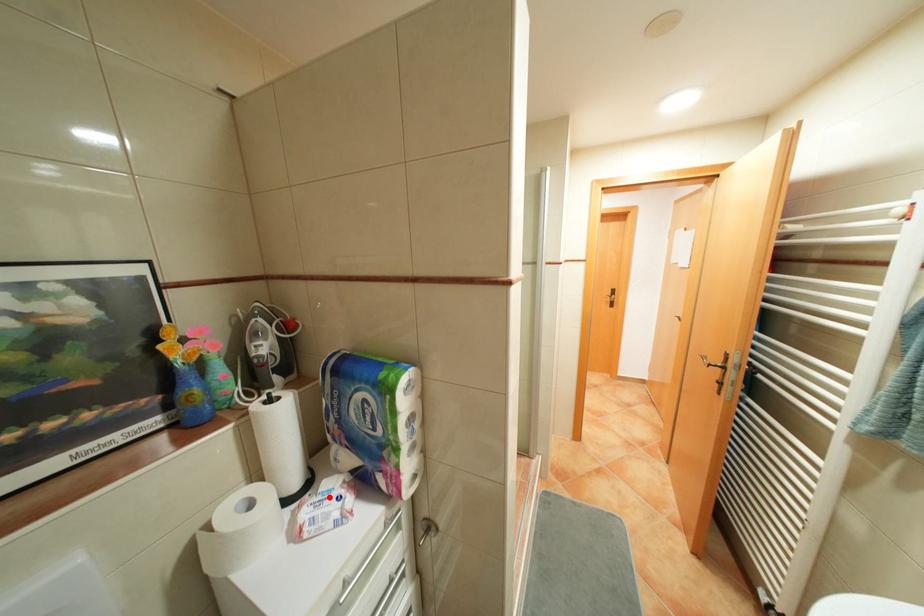
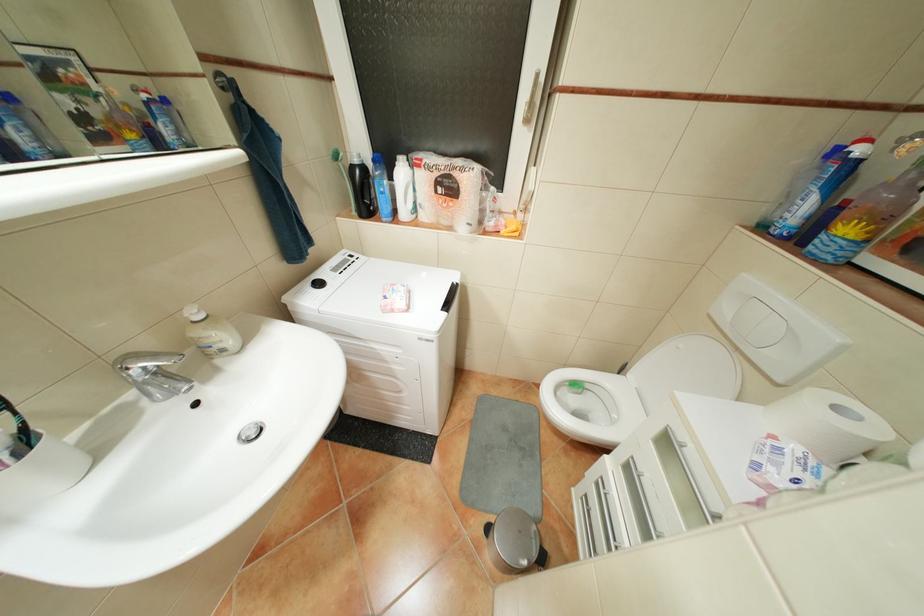
Locate, in the second image, the point that corresponds to the highlighted location in the first image.

(821, 463)